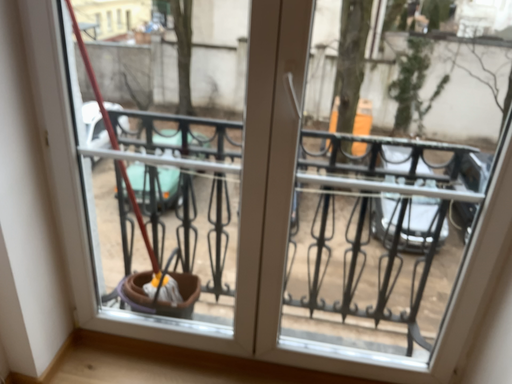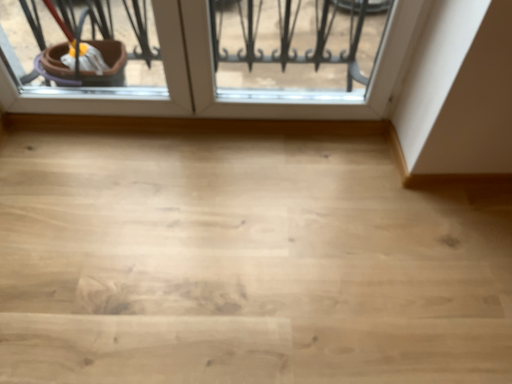
Question: Which way did the camera rotate in the video?

Choices:
 (A) rotated upward
 (B) rotated downward

Answer: (B)